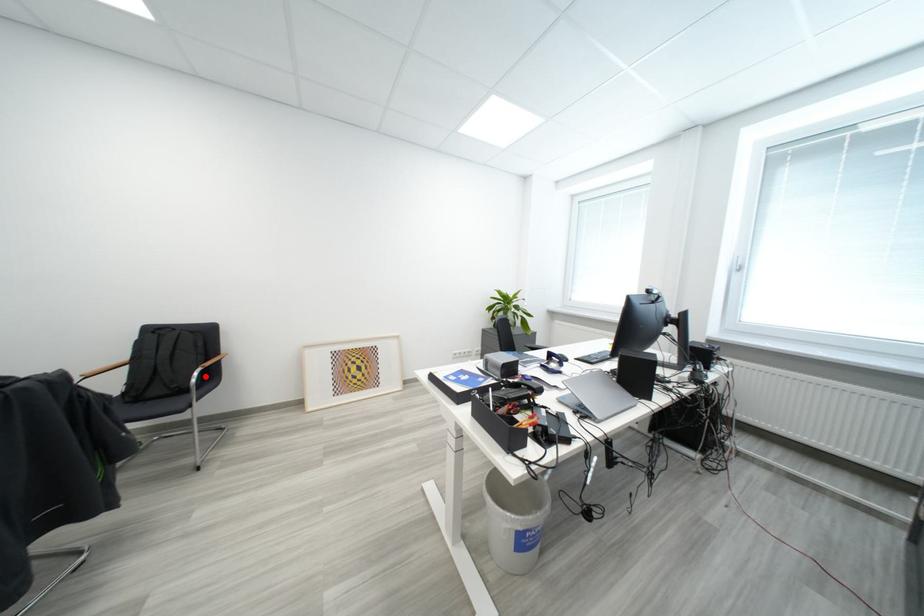
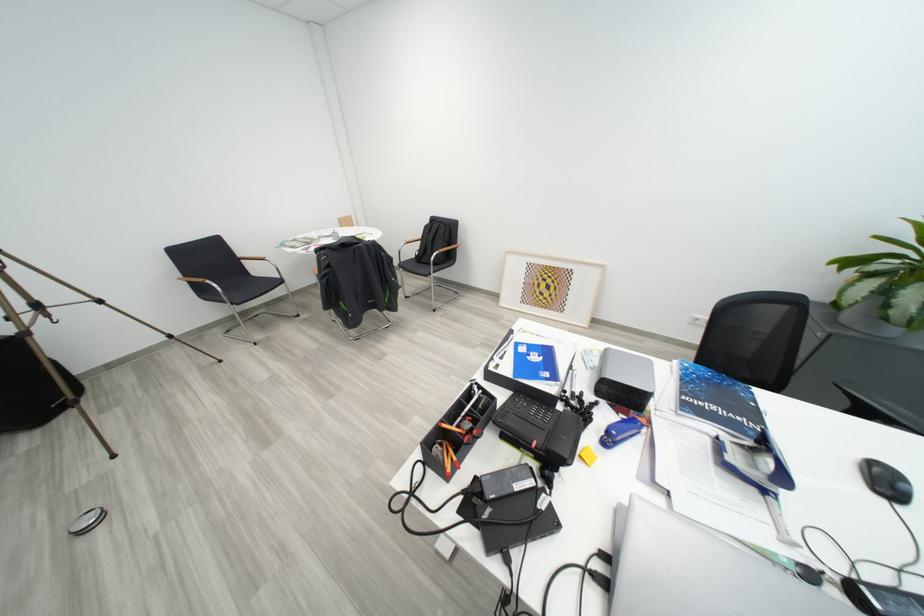
Locate, in the second image, the point that corresponds to the highlighted location in the first image.

(444, 257)